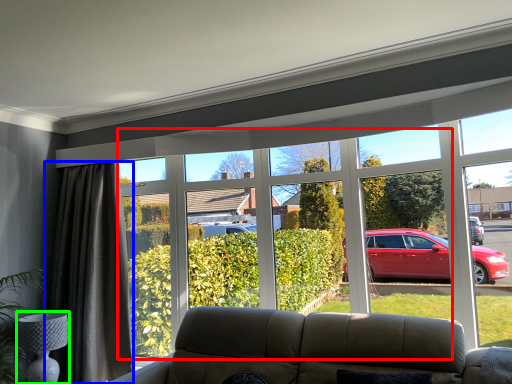
Question: Which object is the farthest from bay window (highlighted by a red box)? Choose among these: curtain (highlighted by a blue box) or lamp (highlighted by a green box).

Choices:
 (A) curtain
 (B) lamp

Answer: (B)